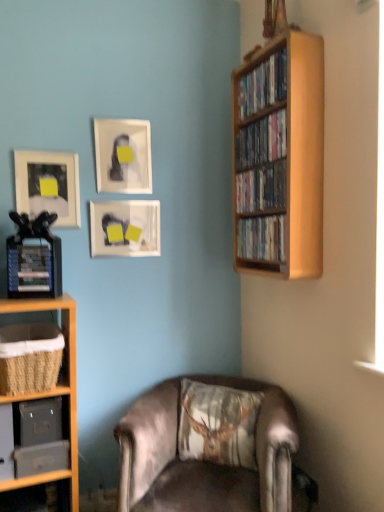
Question: From a real-world perspective, is wooden shelf at upper right, marked as the first book in a top-to-bottom arrangement, physically located above or below printed fabric cushion at lower center?

Choices:
 (A) below
 (B) above

Answer: (B)

Question: Is wooden shelf at upper right, marked as the first book in a top-to-bottom arrangement, wider or thinner than printed fabric cushion at lower center?

Choices:
 (A) wide
 (B) thin

Answer: (B)

Question: Which object is positioned farthest from the wooden shelf at upper right, which is the third book in top-to-bottom order?

Choices:
 (A) printed fabric cushion at lower center
 (B) wooden bookshelf at right
 (C) matte glass picture frame at center, arranged as the 3th picture frame when viewed from the left
 (D) matte black picture frame at upper left, placed as the 3th picture frame when sorted from right to left
 (E) wooden shelf at upper right, placed as the first book when sorted from bottom to top

Answer: (A)

Question: Estimate the real-world distances between objects in this image. Which object is closer to the hardcover book at left?

Choices:
 (A) wooden bookshelf at right
 (B) wooden shelf at upper right, which is the third book in top-to-bottom order
 (C) matte glass picture frame at center, arranged as the 3th picture frame when viewed from the left
 (D) wooden shelf at upper right, placed as the first book when sorted from bottom to top
 (E) woven brown basket at lower left, which appears as the 1th shelf when viewed from the top

Answer: (E)